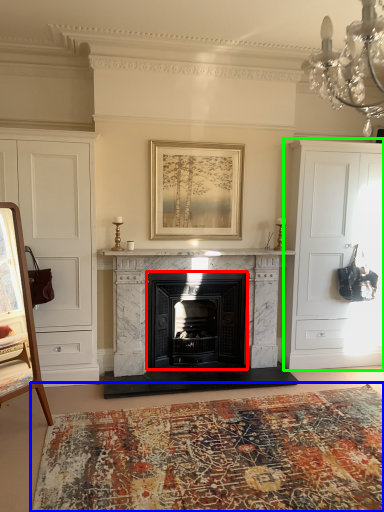
Question: Which is farther away from fireplace (highlighted by a red box)? plain (highlighted by a blue box) or cabinetry (highlighted by a green box)?

Choices:
 (A) plain
 (B) cabinetry

Answer: (A)